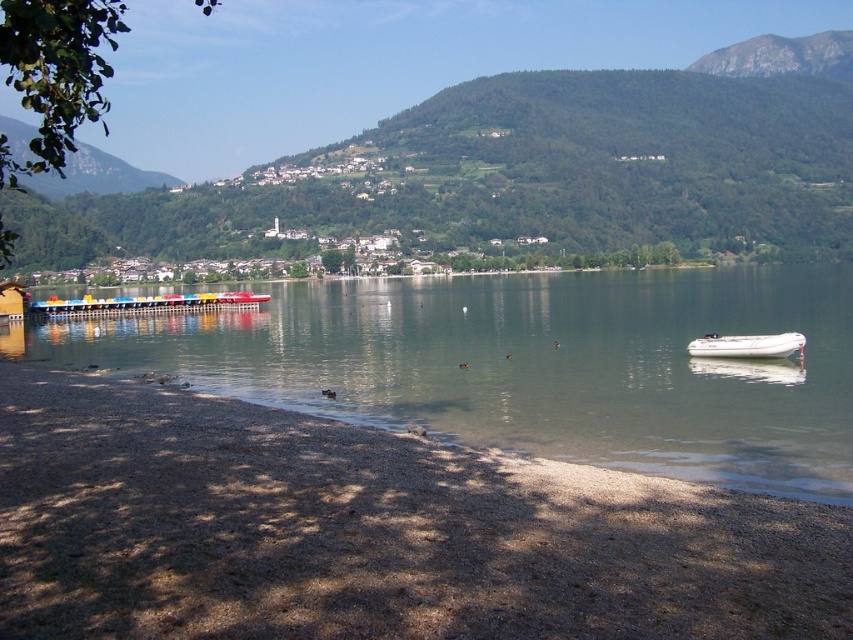
Question: Is brown gravelly sand at lower left further to the viewer compared to clear water at lower left?

Choices:
 (A) yes
 (B) no

Answer: (B)

Question: Which of the following is the closest to the observer?

Choices:
 (A) (695, 348)
 (B) (698, 392)

Answer: (B)

Question: Is clear water at lower left bigger than white rubber boat at lower right?

Choices:
 (A) yes
 (B) no

Answer: (A)

Question: Which point is farther from the camera taking this photo?

Choices:
 (A) 532,630
 (B) 722,356
 (C) 693,404

Answer: (B)

Question: Is brown gravelly sand at lower left thinner than clear water at lower left?

Choices:
 (A) yes
 (B) no

Answer: (A)

Question: Which point is closer to the camera taking this photo?

Choices:
 (A) (813, 401)
 (B) (746, 346)
 (C) (653, 566)

Answer: (C)